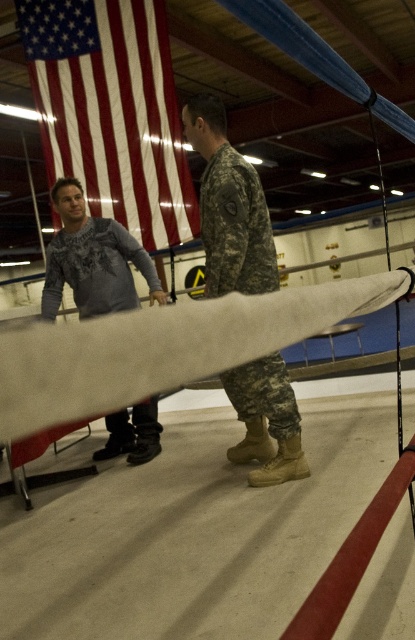
Question: Which is farther from the gray sweater at left?

Choices:
 (A) red-white striped flag at upper left
 (B) camouflage fabric uniform at center

Answer: (A)

Question: Which point appears closest to the camera in this image?

Choices:
 (A) (151, 17)
 (B) (87, 253)
 (C) (195, 340)
 (D) (287, 394)

Answer: (C)

Question: Can you confirm if camouflage fabric uniform at center is bigger than gray sweater at left?

Choices:
 (A) yes
 (B) no

Answer: (B)

Question: Does camouflage fabric uniform at center have a larger size compared to gray sweater at left?

Choices:
 (A) no
 (B) yes

Answer: (A)

Question: Can you confirm if white fabric beam at center is positioned to the left of camouflage fabric uniform at center?

Choices:
 (A) no
 (B) yes

Answer: (A)

Question: Which of these objects is positioned closest to the red-white striped flag at upper left?

Choices:
 (A) white fabric beam at center
 (B) camouflage fabric uniform at center
 (C) gray sweater at left

Answer: (C)